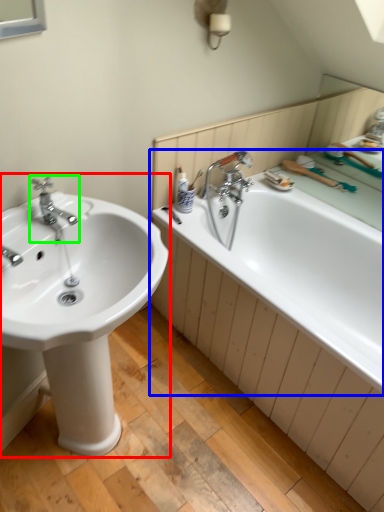
Question: Estimate the real-world distances between objects in this image. Which object is closer to sink (highlighted by a red box), bathtub (highlighted by a blue box) or tap (highlighted by a green box)?

Choices:
 (A) bathtub
 (B) tap

Answer: (B)